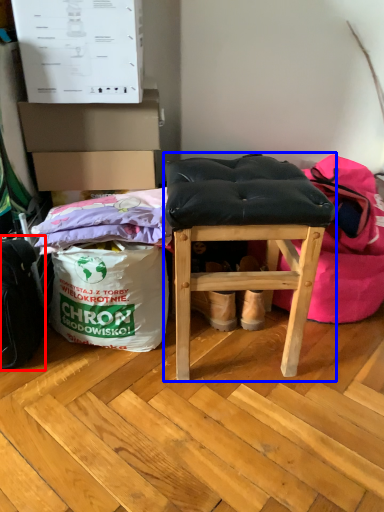
Question: Which object is further to the camera taking this photo, messenger bag (highlighted by a red box) or furniture (highlighted by a blue box)?

Choices:
 (A) messenger bag
 (B) furniture

Answer: (A)